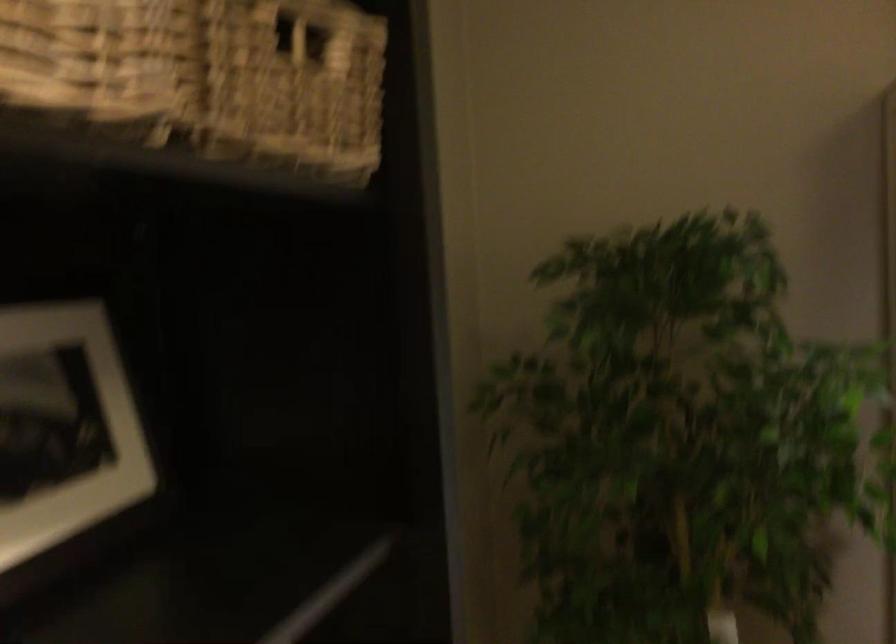
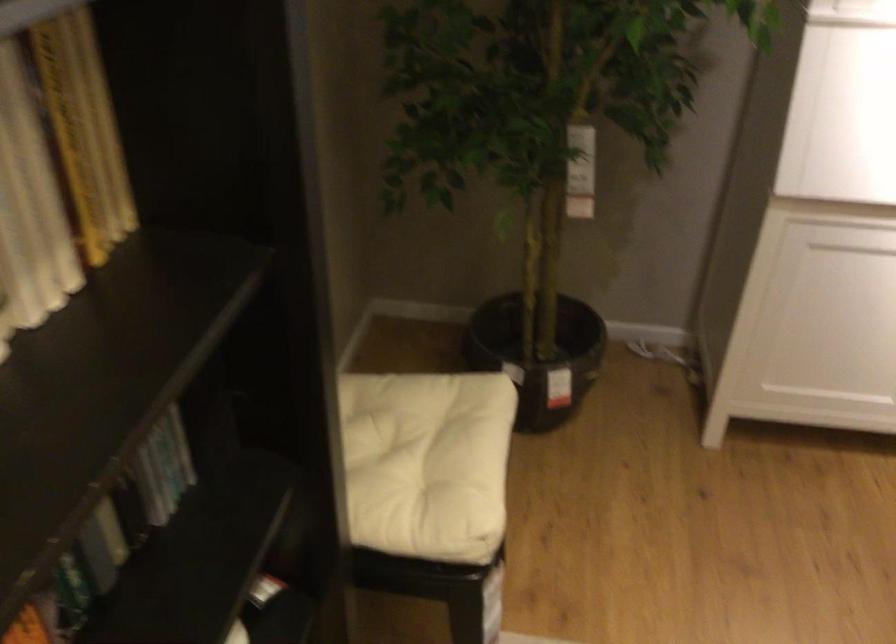
Question: How did the camera likely rotate?

Choices:
 (A) Left
 (B) Right
 (C) Up
 (D) Down

Answer: (D)